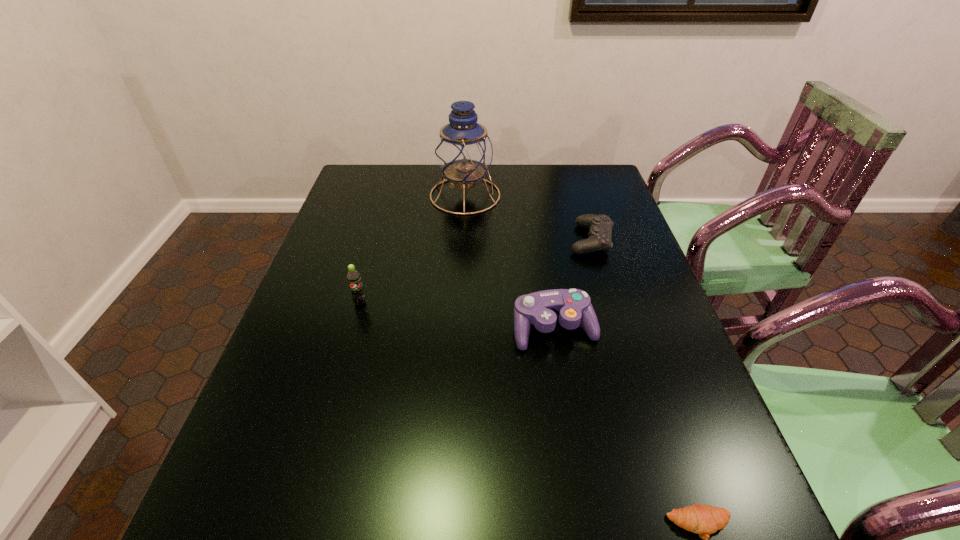
Identify the location of free space at the far right corner. Image resolution: width=960 pixels, height=540 pixels. (616, 199).

Locate an element on the screen. free space between the fourth nearest object and the farthest object is located at coordinates (528, 218).

You are a GUI agent. You are given a task and a screenshot of the screen. Output one action in this format:
    pyautogui.click(x=<x>, y=<y>)
    Task: Click on the vacant area between the farther control and the soda
    The image size is (960, 540).
    Given the screenshot: What is the action you would take?
    pyautogui.click(x=475, y=271)

I want to click on vacant area between the taller control and the farthest object, so click(x=510, y=262).

You are a GUI agent. You are given a task and a screenshot of the screen. Output one action in this format:
    pyautogui.click(x=<x>, y=<y>)
    Task: Click on the object that can be found as the third closest to the tallest object
    The width and height of the screenshot is (960, 540).
    Given the screenshot: What is the action you would take?
    pyautogui.click(x=572, y=306)

Identify which object is located as the nearest to the farthest object. Please provide its 2D coordinates. Your answer should be formatted as a tuple, i.e. [(x, y)], where the tuple contains the x and y coordinates of a point satisfying the conditions above.

[(600, 234)]

Where is `vacant point that satisfies the following two spatial constraints: 1. on the back side of the third tallest object; 2. on the front-facing side of the second object from left to right`? vacant point that satisfies the following two spatial constraints: 1. on the back side of the third tallest object; 2. on the front-facing side of the second object from left to right is located at coordinates (533, 195).

What are the coordinates of `free location that satisfies the following two spatial constraints: 1. on the front label of the fourth shortest object; 2. on the right side of the nearer control` in the screenshot? It's located at (352, 329).

In order to click on free spot that satisfies the following two spatial constraints: 1. on the front-facing side of the fourth object from right to left; 2. on the right side of the third tallest object in this screenshot , I will do `click(459, 329)`.

Identify the location of free space in the image that satisfies the following two spatial constraints: 1. on the front label of the nearer control; 2. on the left side of the soda. Image resolution: width=960 pixels, height=540 pixels. (352, 329).